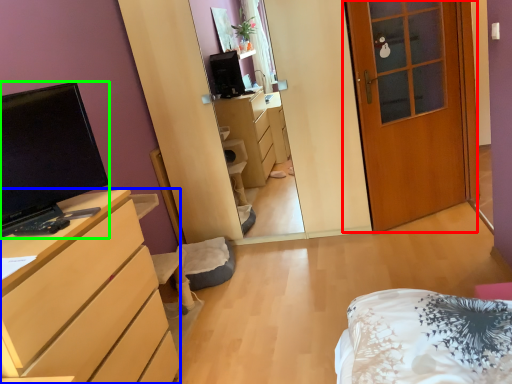
Question: Which object is the closest to the door (highlighted by a red box)? Choose among these: cabinetry (highlighted by a blue box) or television (highlighted by a green box).

Choices:
 (A) cabinetry
 (B) television

Answer: (A)